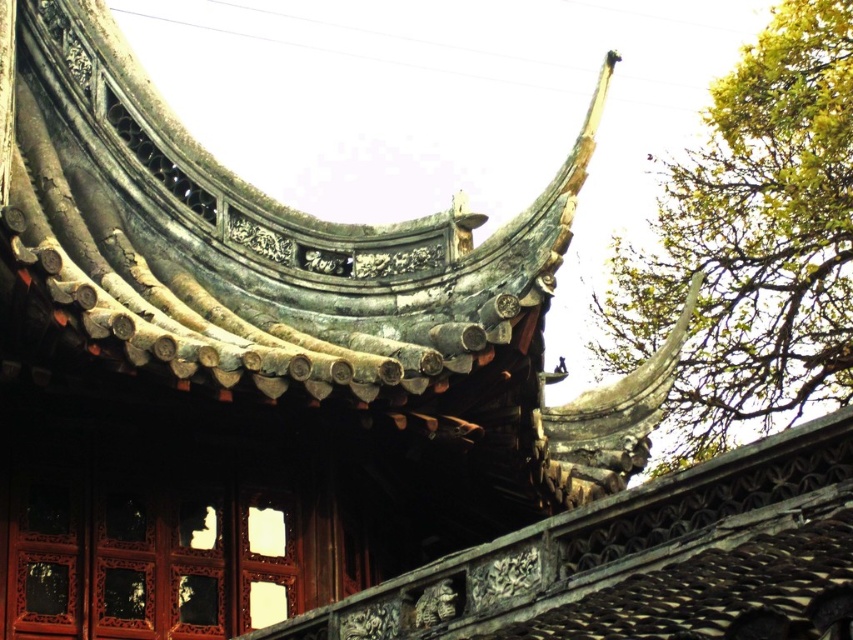
Locate an element on the screen. greenish-gray stone roof at upper center is located at coordinates (245, 237).

Does point (42, 204) lie behind point (724, 330)?

No, (42, 204) is closer to viewer.

Locate an element on the screen. greenish-gray stone roof at upper center is located at coordinates (245, 237).